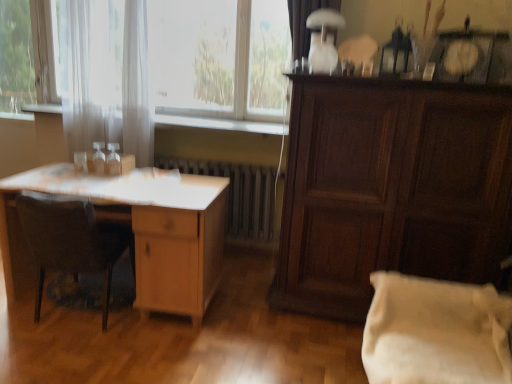
This screenshot has width=512, height=384. Describe the element at coordinates (138, 232) in the screenshot. I see `light wood desk at left` at that location.

The height and width of the screenshot is (384, 512). Describe the element at coordinates (238, 194) in the screenshot. I see `metallic silver radiator at center` at that location.

What do you see at coordinates (304, 22) in the screenshot? I see `white matte curtain at upper center, the first curtain from the right` at bounding box center [304, 22].

Measure the distance between point (x=294, y=79) and camera.

Point (x=294, y=79) is 2.31 meters from camera.

Image resolution: width=512 pixels, height=384 pixels. What are the coordinates of `dark wood cabinet at right` in the screenshot? It's located at (390, 188).

In order to face wooden chair at left, should I rotate leftwards or rightwards?

Turn left by 22.228 degrees to look at wooden chair at left.

Image resolution: width=512 pixels, height=384 pixels. What are the coordinates of `light wood desk at left` in the screenshot? It's located at (138, 232).

From a real-world perspective, who is located higher, white sheer curtain at upper left or metallic silver radiator at center?

From a 3D spatial view, white sheer curtain at upper left is above.

From the picture: From the image's perspective, between white sheer curtain at upper left and metallic silver radiator at center, who is located below?

metallic silver radiator at center, from the image's perspective.

Considering the relative sizes of white sheer curtain at upper left and metallic silver radiator at center in the image provided, is white sheer curtain at upper left bigger than metallic silver radiator at center?

Yes, white sheer curtain at upper left is bigger than metallic silver radiator at center.

Is white sheer curtain at upper left wider than metallic silver radiator at center?

Incorrect, the width of white sheer curtain at upper left does not surpass that of metallic silver radiator at center.

Does wooden chair at left appear on the right side of white sheer curtain at upper left?

No.

Could white sheer curtain at upper left be considered to be inside wooden chair at left?

No.

Which object is further away from the camera taking this photo, wooden chair at left or white sheer curtain at upper left?

white sheer curtain at upper left is further from the camera.

Between point (98, 262) and point (277, 124), which one is positioned in front?

The point (98, 262) is closer to the camera.

From a real-world perspective, is light wood desk at left physically located above or below metallic silver radiator at center?

Clearly, from a real-world perspective, light wood desk at left is below metallic silver radiator at center.

Is point (157, 261) farther from camera compared to point (183, 169)?

No, it is in front of (183, 169).

In order to click on desk on the left of metallic silver radiator at center in this screenshot , I will do `click(138, 232)`.

Considering the sizes of light wood desk at left and metallic silver radiator at center in the image, is light wood desk at left taller or shorter than metallic silver radiator at center?

Clearly, light wood desk at left is taller compared to metallic silver radiator at center.

In the scene shown: Can you tell me how much white cotton pillow at lower right and white matte curtain at upper center, the first curtain from the right, differ in facing direction?

white cotton pillow at lower right and white matte curtain at upper center, the first curtain from the right, are facing 88.5 degrees away from each other.

Which is nearer, (369, 347) or (324, 1)?

The point (369, 347) is closer to the camera.

From the image's perspective, between white cotton pillow at lower right and white matte curtain at upper center, which ranks as the 1th curtain in front-to-back order, who is located below?

white cotton pillow at lower right, from the image's perspective.

From a real-world perspective, between light wood desk at left and white sheer curtain at upper left, who is vertically higher?

white sheer curtain at upper left, from a real-world perspective.

Considering the sizes of objects light wood desk at left and white sheer curtain at upper left in the image provided, who is thinner, light wood desk at left or white sheer curtain at upper left?

Thinner between the two is white sheer curtain at upper left.

Considering the positions of objects light wood desk at left and white sheer curtain at upper left in the image provided, who is in front, light wood desk at left or white sheer curtain at upper left?

light wood desk at left is more forward.

Based on the photo, is light wood desk at left situated inside white sheer curtain at upper left or outside?

light wood desk at left lies outside white sheer curtain at upper left.

Who is smaller, wooden chair at left or dark wood cabinet at right?

wooden chair at left.

Based on their positions, is wooden chair at left located to the left or right of dark wood cabinet at right?

Based on their positions, wooden chair at left is located to the left of dark wood cabinet at right.

Who is more distant, wooden chair at left or dark wood cabinet at right?

wooden chair at left is behind.

What's the angular difference between wooden chair at left and dark wood cabinet at right's facing directions?

179 degrees.

I want to click on pillow that appears in front of the metallic silver radiator at center, so click(435, 332).

Who is smaller, white cotton pillow at lower right or metallic silver radiator at center?

metallic silver radiator at center.

Does white cotton pillow at lower right have a lesser height compared to metallic silver radiator at center?

Correct, white cotton pillow at lower right is not as tall as metallic silver radiator at center.

Identify the location of radiator lying on the right of white sheer curtain at upper left. Image resolution: width=512 pixels, height=384 pixels. (238, 194).

You are a GUI agent. You are given a task and a screenshot of the screen. Output one action in this format:
    pyautogui.click(x=<x>, y=<y>)
    Task: Click on the chair on the left side of white sheer curtain at upper left
    The height and width of the screenshot is (384, 512).
    Given the screenshot: What is the action you would take?
    pyautogui.click(x=72, y=241)

Considering their positions, is white sheer curtain at left, the second curtain when ordered from right to left, positioned closer to white sheer curtain at upper left than wooden chair at left?

Based on the image, white sheer curtain at left, the second curtain when ordered from right to left, appears to be nearer to white sheer curtain at upper left.

Consider the image. When comparing their distances from metallic silver radiator at center, does white sheer curtain at upper left or white sheer curtain at left, placed as the 1th curtain when sorted from left to right, seem closer?

white sheer curtain at upper left.

Considering their positions, is wooden chair at left positioned further to white sheer curtain at left, placed as the 1th curtain when sorted from left to right, than white matte curtain at upper center, acting as the second curtain starting from the left?

white matte curtain at upper center, acting as the second curtain starting from the left, is further to white sheer curtain at left, placed as the 1th curtain when sorted from left to right.

Based on their spatial positions, is white cotton pillow at lower right or wooden chair at left further from white sheer curtain at upper left?

white cotton pillow at lower right is further to white sheer curtain at upper left.

From the image, which object appears to be farther from white sheer curtain at upper left, white matte curtain at upper center, the first curtain from the right, or light wood desk at left?

Based on the image, light wood desk at left appears to be further to white sheer curtain at upper left.

Considering their positions, is dark wood cabinet at right positioned closer to white wood at center than metallic silver radiator at center?

Among the two, metallic silver radiator at center is located nearer to white wood at center.

Considering their positions, is metallic silver radiator at center positioned closer to wooden chair at left than white cotton pillow at lower right?

Among the two, metallic silver radiator at center is located nearer to wooden chair at left.

Consider the image. Based on their spatial positions, is dark wood cabinet at right or white matte curtain at upper center, the first curtain from the right, closer to wooden chair at left?

Among the two, dark wood cabinet at right is located nearer to wooden chair at left.

Locate an element on the screen. This screenshot has height=384, width=512. radiator between white sheer curtain at left, the second curtain positioned from the front, and dark wood cabinet at right from left to right is located at coordinates (238, 194).

Where is `cabinetry between white matte curtain at upper center, which ranks as the 1th curtain in front-to-back order, and white cotton pillow at lower right vertically`? Image resolution: width=512 pixels, height=384 pixels. cabinetry between white matte curtain at upper center, which ranks as the 1th curtain in front-to-back order, and white cotton pillow at lower right vertically is located at coordinates (390, 188).

This screenshot has width=512, height=384. I want to click on desk situated between white sheer curtain at left, placed as the 1th curtain when sorted from left to right, and white cotton pillow at lower right from left to right, so click(x=138, y=232).

The height and width of the screenshot is (384, 512). I want to click on curtain situated between wooden chair at left and white cotton pillow at lower right from left to right, so click(304, 22).